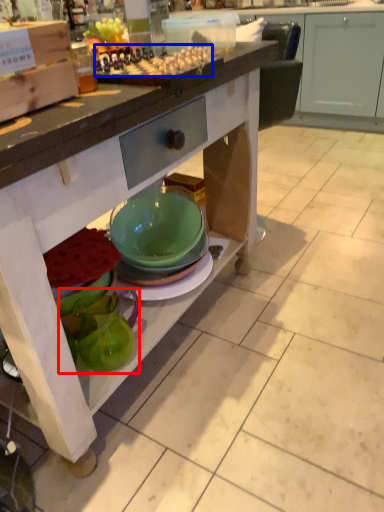
Question: Which object is further to the camera taking this photo, tableware (highlighted by a red box) or food (highlighted by a blue box)?

Choices:
 (A) tableware
 (B) food

Answer: (A)